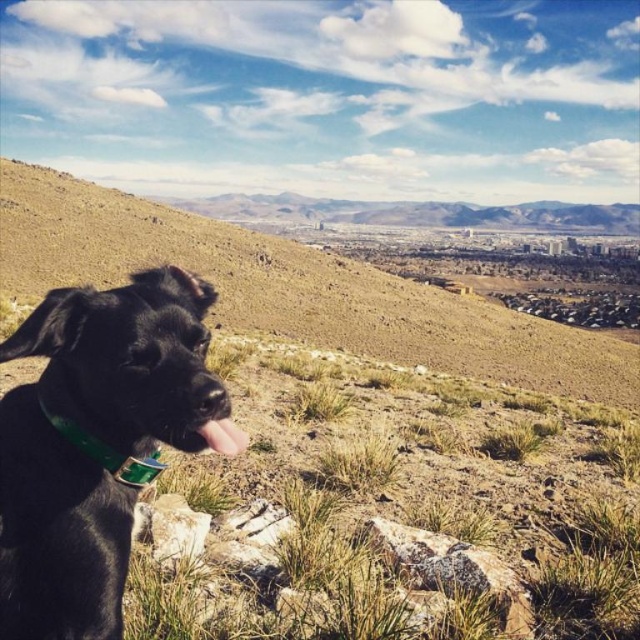
Does shiny black dog at lower left have a greater width compared to brown grassy hillside at lower left?

In fact, shiny black dog at lower left might be narrower than brown grassy hillside at lower left.

Is point (99, 545) farther from viewer compared to point (74, 195)?

No, (99, 545) is closer to viewer.

Locate an element on the screen. The height and width of the screenshot is (640, 640). shiny black dog at lower left is located at coordinates (97, 442).